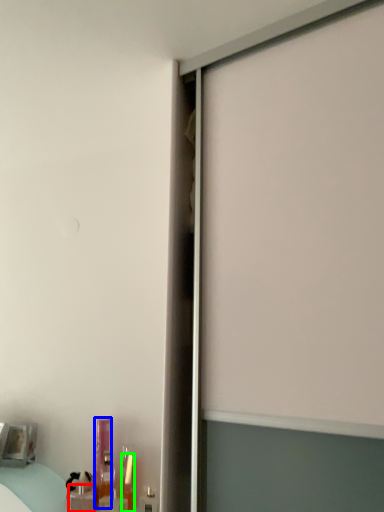
Question: Considering the real-world distances, which object is farthest from toiletry (highlighted by a red box)? toiletry (highlighted by a blue box) or toiletry (highlighted by a green box)?

Choices:
 (A) toiletry
 (B) toiletry

Answer: (B)